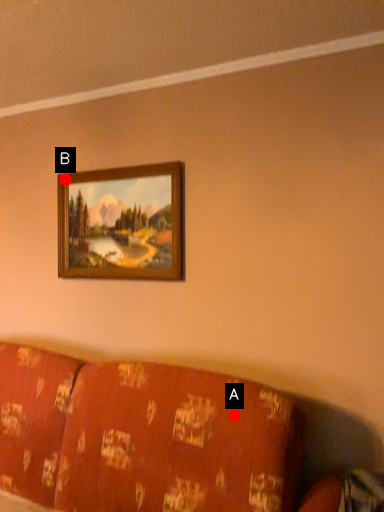
Question: Two points are circled on the image, labeled by A and B beside each circle. Which point is farther from the camera taking this photo?

Choices:
 (A) A is further
 (B) B is further

Answer: (B)